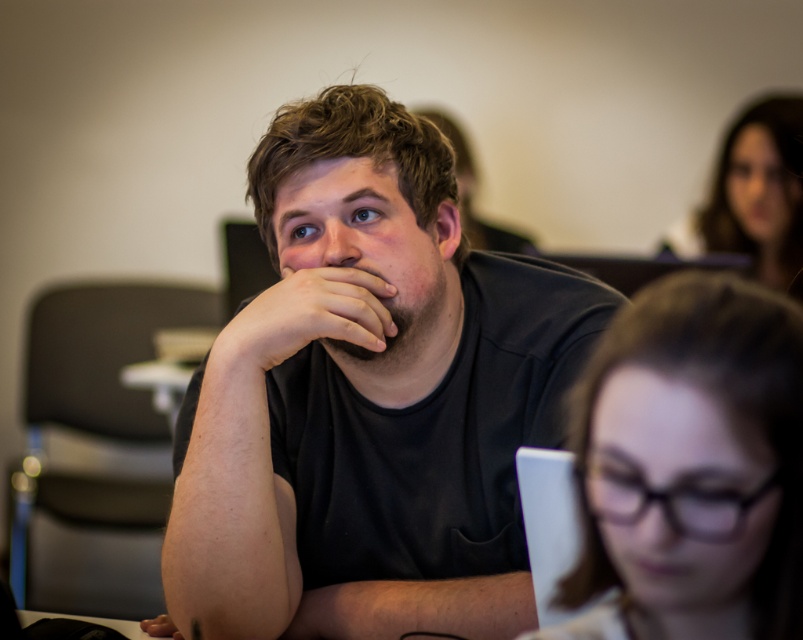
Question: Estimate the real-world distances between objects in this image. Which object is farther from the black matte shirt at center?

Choices:
 (A) clear plastic glasses at center
 (B) matte black hand at center

Answer: (A)

Question: Which point is closer to the camera?

Choices:
 (A) (642, 621)
 (B) (492, 369)

Answer: (A)

Question: Can you confirm if clear plastic glasses at center is positioned above matte black hand at center?

Choices:
 (A) no
 (B) yes

Answer: (A)

Question: Can you confirm if black matte shirt at center is positioned below clear plastic glasses at center?

Choices:
 (A) no
 (B) yes

Answer: (A)

Question: Can you confirm if clear plastic glasses at center is thinner than matte black hand at center?

Choices:
 (A) yes
 (B) no

Answer: (A)

Question: Estimate the real-world distances between objects in this image. Which object is closer to the matte black hand at center?

Choices:
 (A) black matte shirt at center
 (B) smooth brown hair at upper right
 (C) clear plastic glasses at center

Answer: (A)